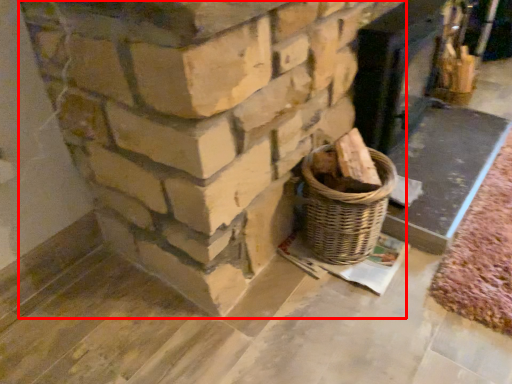
Question: From the image's perspective, what is the correct spatial relationship of fireplace (annotated by the red box) in relation to fireplace?

Choices:
 (A) below
 (B) above

Answer: (A)